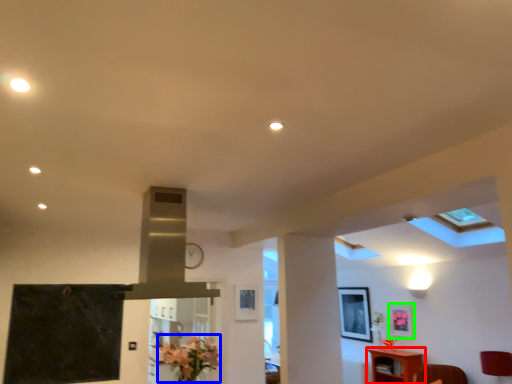
Question: Which object is positioned closest to furniture (highlighted by a red box)? Select from flower (highlighted by a blue box) and picture frame (highlighted by a green box).

Choices:
 (A) flower
 (B) picture frame

Answer: (B)